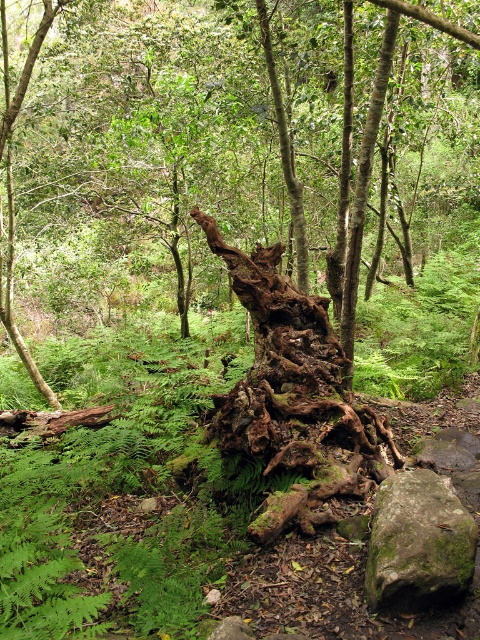
In the scene shown: You are a park ranger measuring distances between two rusty wood objects in the forest. You have a measuring tape that can extend up to 30 feet. Can you confirm if the distance between the rusty wood log at center and the rusty wood tree trunk at center is within your measuring tape range?

The distance between the rusty wood log at center and the rusty wood tree trunk at center is 29.22 feet, which is within the measuring tape range of up to 30 feet. Yes, the measuring tape can measure this distance.

You are a hiker who wants to step on the green mossy rock at lower right to avoid getting your shoes dirty. Is the rusty wood tree trunk at center blocking your path?

The rusty wood tree trunk at center is positioned over green mossy rock at lower right, so the trunk is blocking the path to the rock. You cannot step on the green mossy rock at lower right directly because it is covered by the trunk.

From the picture: You are standing in the forest and see the point marked as point (241, 172). What object is located at that point?

The rusty wood log at center is located at point (241, 172).